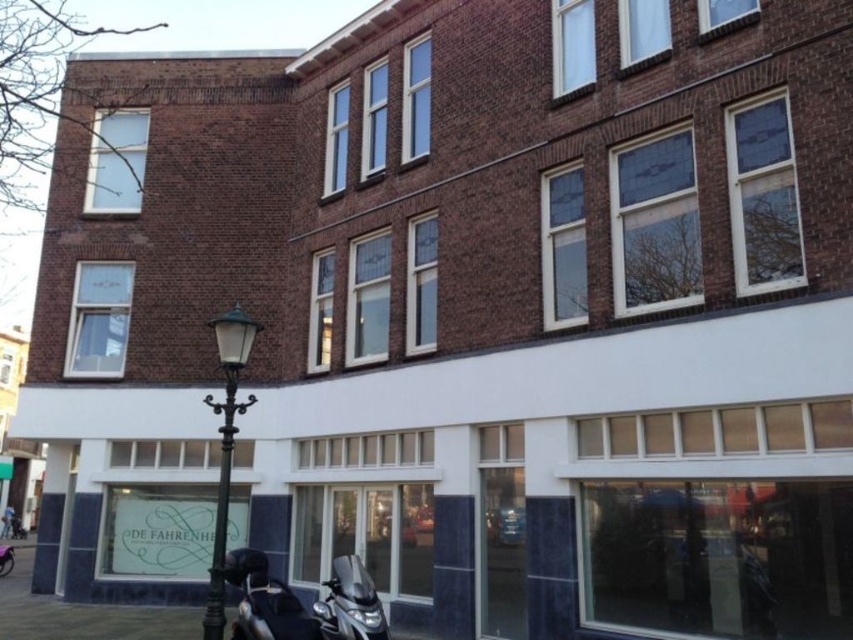
Question: Is shiny black motorcycle at lower left to the left of shiny metallic motorcycle at lower center from the viewer's perspective?

Choices:
 (A) yes
 (B) no

Answer: (A)

Question: Which of these objects is positioned closest to the shiny black motorcycle at lower left?

Choices:
 (A) black wrought iron streetlight at lower left
 (B) shiny metallic motorcycle at lower center

Answer: (B)

Question: Which object is positioned farthest from the shiny black motorcycle at lower left?

Choices:
 (A) black wrought iron streetlight at lower left
 (B) shiny metallic motorcycle at lower center

Answer: (A)

Question: Does black wrought iron streetlight at lower left have a larger size compared to shiny metallic motorcycle at lower center?

Choices:
 (A) no
 (B) yes

Answer: (A)

Question: Which point is farther from the camera taking this photo?

Choices:
 (A) (337, 605)
 (B) (306, 627)

Answer: (B)

Question: Can you confirm if shiny black motorcycle at lower left is thinner than shiny metallic motorcycle at lower center?

Choices:
 (A) no
 (B) yes

Answer: (A)